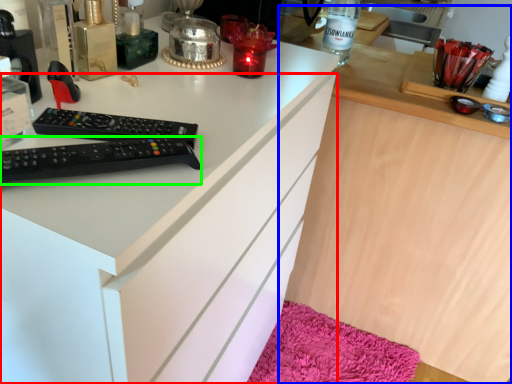
Question: Which object is the farthest from cabinetry (highlighted by a red box)? Choose among these: computer (highlighted by a blue box) or remote control (highlighted by a green box).

Choices:
 (A) computer
 (B) remote control

Answer: (A)